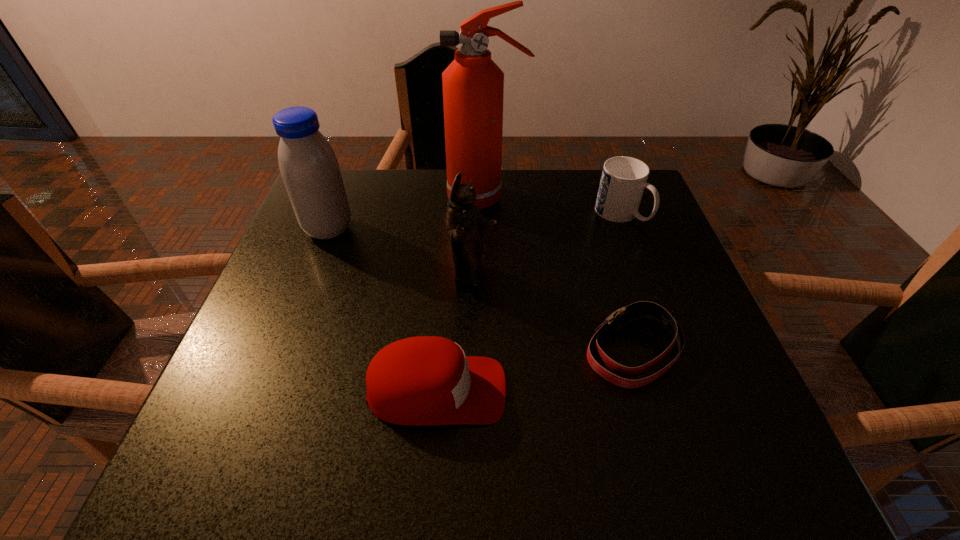
The width and height of the screenshot is (960, 540). Identify the location of mug that is at the right edge. (623, 180).

You are a GUI agent. You are given a task and a screenshot of the screen. Output one action in this format:
    pyautogui.click(x=<x>, y=<y>)
    Task: Click on the dog collar located at the right edge
    The image size is (960, 540).
    Given the screenshot: What is the action you would take?
    pyautogui.click(x=618, y=318)

The width and height of the screenshot is (960, 540). I want to click on object that is at the far left corner, so click(308, 165).

I want to click on object that is at the far right corner, so click(623, 180).

Image resolution: width=960 pixels, height=540 pixels. In order to click on blank space at the far edge of the desktop in this screenshot , I will do `click(533, 189)`.

Find the location of `vacant area at the near edge`. vacant area at the near edge is located at coordinates (592, 449).

The width and height of the screenshot is (960, 540). Identify the location of free spot at the left edge of the desktop. (301, 228).

Find the location of a particular element. This screenshot has height=540, width=960. free space at the right edge of the desktop is located at coordinates (657, 283).

I want to click on vacant area at the far left corner, so click(354, 213).

The width and height of the screenshot is (960, 540). In order to click on free spot between the third shortest object and the third nearest object in this screenshot , I will do `click(546, 246)`.